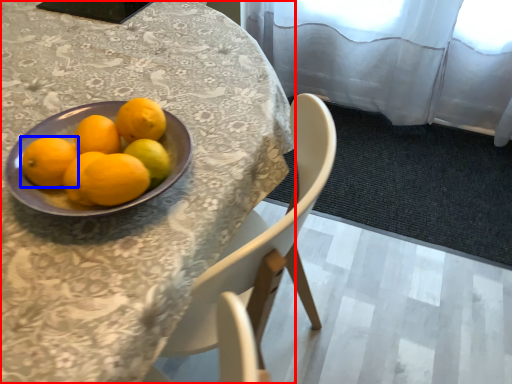
Question: Which object is closer to the camera taking this photo, table (highlighted by a red box) or orange (highlighted by a blue box)?

Choices:
 (A) table
 (B) orange

Answer: (A)